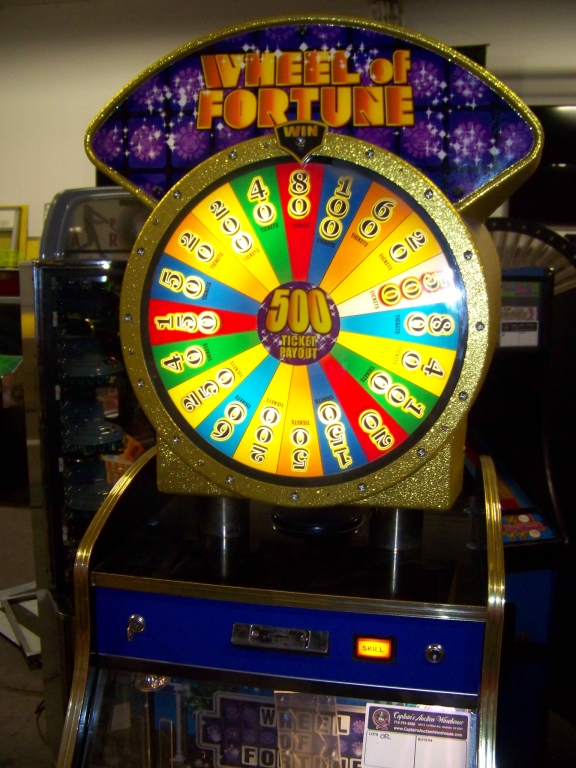
Locate an element on the screen. This screenshot has height=768, width=576. wall is located at coordinates (48, 159).